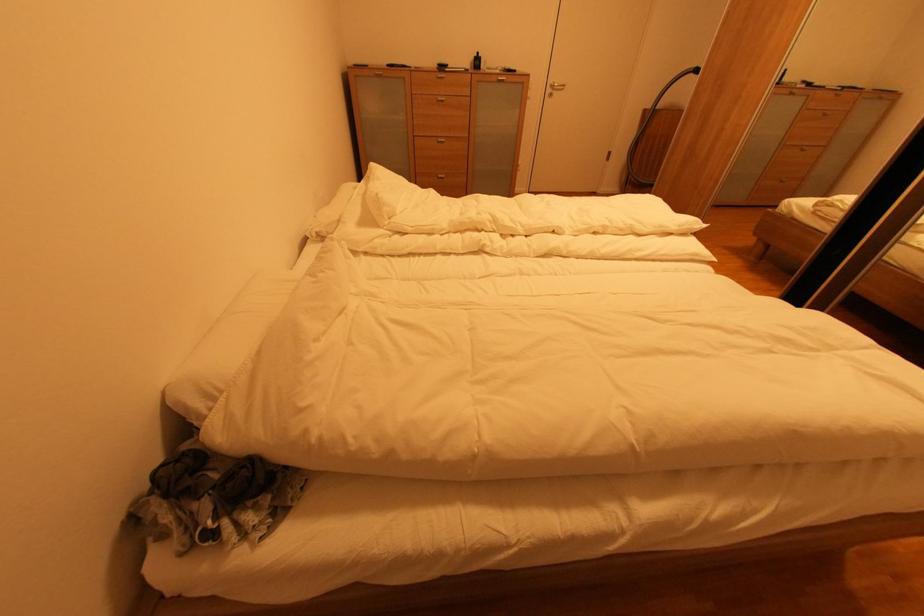
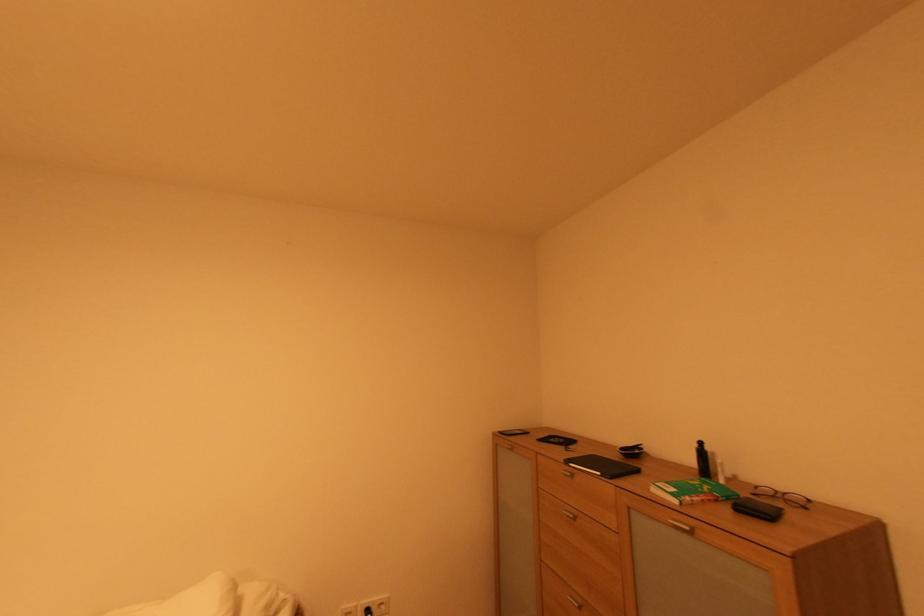
Find the pixel in the second image that matches (x=504, y=73) in the first image.

(682, 503)